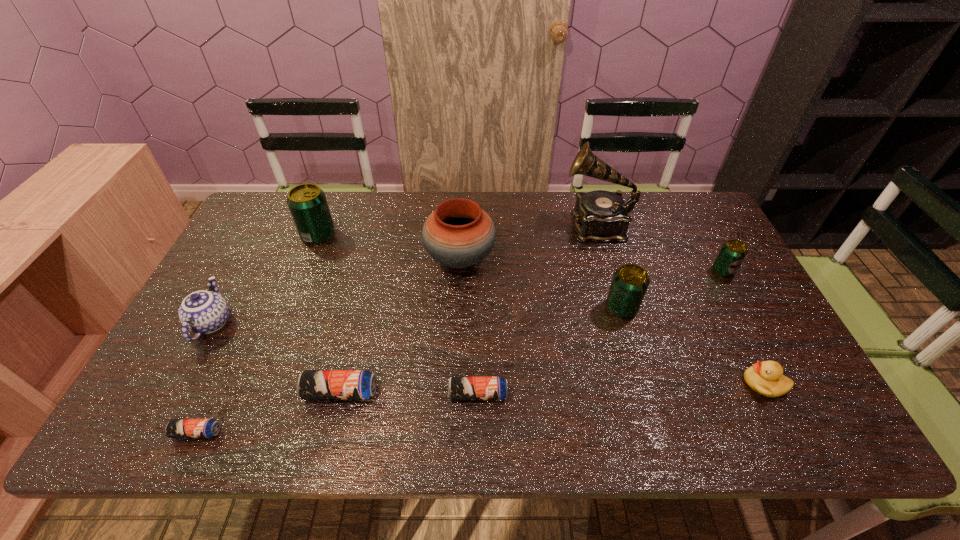
The width and height of the screenshot is (960, 540). I want to click on vacant space located on the front of the biggest green beer can, so click(x=284, y=323).

The width and height of the screenshot is (960, 540). Find the location of `free space located on the left of the nearest green beer can`. free space located on the left of the nearest green beer can is located at coordinates 546,308.

The width and height of the screenshot is (960, 540). I want to click on vacant region located 0.110m at the spout of the blue chinaware, so click(x=241, y=269).

Find the location of a particular element. free region located at the spout of the blue chinaware is located at coordinates (272, 211).

Find the location of a particular element. This screenshot has width=960, height=540. vacant space situated 0.220m at the spout of the blue chinaware is located at coordinates 253,244.

Identify the location of free space located on the front of the second farthest beer can. (750, 320).

Where is `free point located 0.220m on the front-facing side of the yellow duckling`? free point located 0.220m on the front-facing side of the yellow duckling is located at coordinates (651, 383).

This screenshot has width=960, height=540. Find the location of `free space located on the front-facing side of the yellow duckling`. free space located on the front-facing side of the yellow duckling is located at coordinates (575, 383).

I want to click on free region located on the front-facing side of the yellow duckling, so click(x=672, y=383).

At what (x,y) coordinates should I click in order to perform the action: click on vacant space located on the right of the seventh object from right to left. Please return your answer as a coordinate pair (x, y). Looking at the image, I should click on (411, 392).